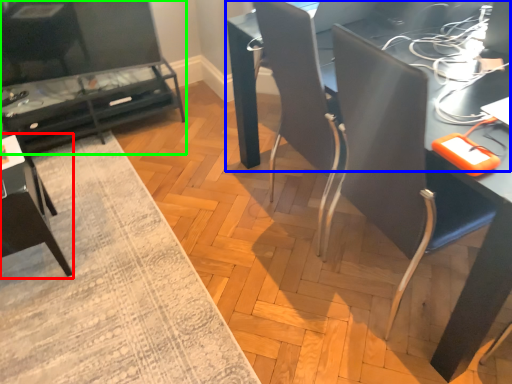
Question: Which object is the farthest from armchair (highlighted by a red box)? Choose among these: table (highlighted by a blue box) or table (highlighted by a green box).

Choices:
 (A) table
 (B) table

Answer: (A)